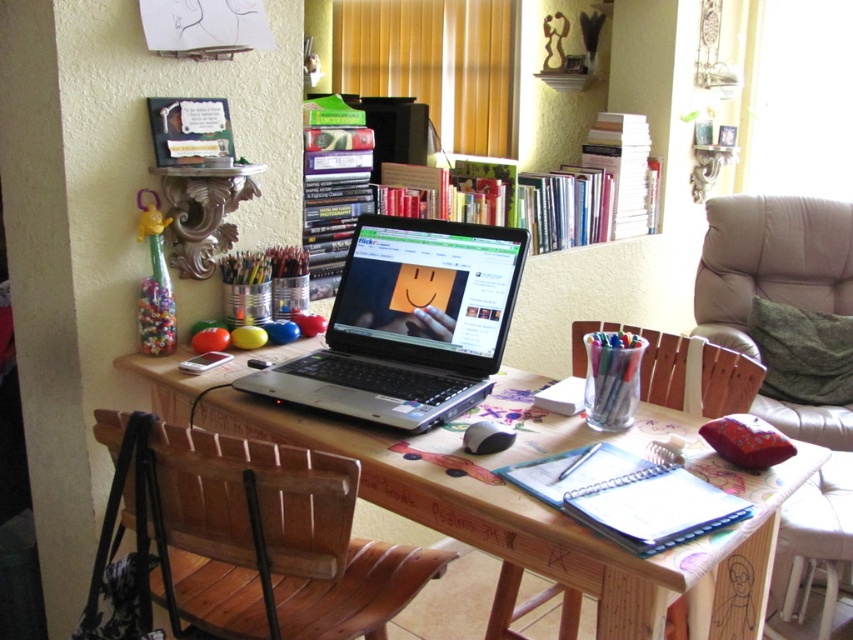
Does wooden armchair at right come behind black plastic mouse at lower center?

That is True.

Who is positioned more to the left, wooden armchair at right or black plastic mouse at lower center?

From the viewer's perspective, black plastic mouse at lower center appears more on the left side.

Describe the element at coordinates (527, 605) in the screenshot. The image size is (853, 640). I see `wooden armchair at right` at that location.

In order to click on wooden armchair at right in this screenshot , I will do `click(527, 605)`.

Between wooden armchair at right and transparent plastic cup at center, which one has less height?

Standing shorter between the two is transparent plastic cup at center.

Can you confirm if wooden armchair at right is positioned to the right of transparent plastic cup at center?

Correct, you'll find wooden armchair at right to the right of transparent plastic cup at center.

Identify the location of wooden armchair at right. (527, 605).

Can you confirm if silver/black plastic laptop at center is positioned to the left of green fabric cushion at right?

Yes, silver/black plastic laptop at center is to the left of green fabric cushion at right.

Who is more forward, (416,381) or (746,195)?

Point (416,381)

At what (x,y) coordinates should I click in order to perform the action: click on silver/black plastic laptop at center. Please return your answer as a coordinate pair (x, y). Image resolution: width=853 pixels, height=640 pixels. Looking at the image, I should click on (408, 324).